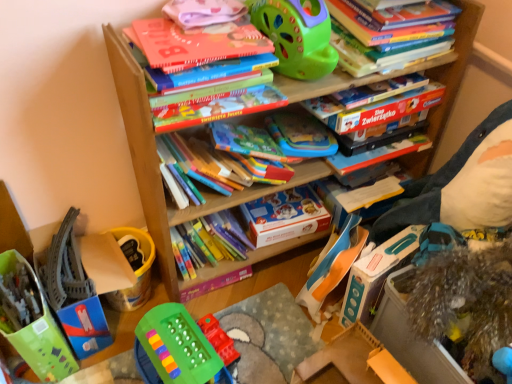
Question: Is translucent plastic toy at lower left, the 1th toy when ordered from left to right, inside matte cardboard box at center?

Choices:
 (A) no
 (B) yes

Answer: (A)

Question: Is matte cardboard box at center closer to camera compared to translucent plastic toy at lower left, the sixth toy from the right?

Choices:
 (A) yes
 (B) no

Answer: (B)

Question: Is translucent plastic toy at lower left, the sixth toy from the right, at the back of matte cardboard box at center?

Choices:
 (A) no
 (B) yes

Answer: (A)

Question: Can you confirm if matte cardboard box at center is smaller than translucent plastic toy at lower left, the sixth toy from the right?

Choices:
 (A) no
 (B) yes

Answer: (B)

Question: From a real-world perspective, is matte cardboard box at center located beneath translucent plastic toy at lower left, the 1th toy when ordered from left to right?

Choices:
 (A) yes
 (B) no

Answer: (B)

Question: Considering the relative sizes of matte cardboard box at center and translucent plastic toy at lower left, the 1th toy when ordered from left to right, in the image provided, is matte cardboard box at center wider than translucent plastic toy at lower left, the 1th toy when ordered from left to right,?

Choices:
 (A) no
 (B) yes

Answer: (A)

Question: From a real-world perspective, is blue plastic toy at lower right, which is the 5th toy in left-to-right order, physically above wooden toy at lower right?

Choices:
 (A) no
 (B) yes

Answer: (B)

Question: Is blue plastic toy at lower right, the second toy viewed from the right, turned away from wooden toy at lower right?

Choices:
 (A) yes
 (B) no

Answer: (B)

Question: Is blue plastic toy at lower right, which is the 5th toy in left-to-right order, to the left of wooden toy at lower right from the viewer's perspective?

Choices:
 (A) no
 (B) yes

Answer: (A)

Question: From the image's perspective, is blue plastic toy at lower right, the second toy viewed from the right, on wooden toy at lower right?

Choices:
 (A) no
 (B) yes

Answer: (B)

Question: Could you tell me if blue plastic toy at lower right, which is the 5th toy in left-to-right order, is turned towards wooden toy at lower right?

Choices:
 (A) no
 (B) yes

Answer: (A)

Question: Considering the relative sizes of wooden toy at lower right and rubberized plastic toy at center, the 4th toy viewed from the right, in the image provided, is wooden toy at lower right taller than rubberized plastic toy at center, the 4th toy viewed from the right,?

Choices:
 (A) no
 (B) yes

Answer: (B)